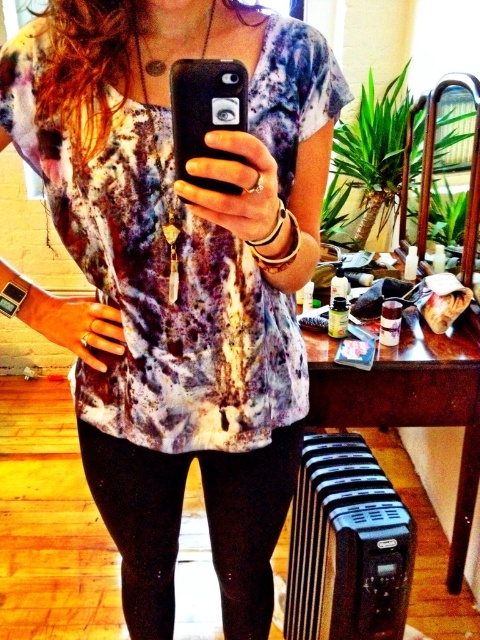
Does matte tie-dye blouse at center appear over black spandex leggings at lower center?

Yes, matte tie-dye blouse at center is above black spandex leggings at lower center.

Does matte tie-dye blouse at center have a larger size compared to black spandex leggings at lower center?

Yes.

Where is `matte tie-dye blouse at center`? The width and height of the screenshot is (480, 640). matte tie-dye blouse at center is located at coordinates (179, 275).

Can you confirm if black spandex leggings at lower center is smaller than black matte phone at center?

Incorrect, black spandex leggings at lower center is not smaller in size than black matte phone at center.

Is point (141, 620) farther from viewer compared to point (184, 161)?

Yes, point (141, 620) is farther from viewer.

Which is in front, point (119, 452) or point (196, 129)?

Point (196, 129)

The height and width of the screenshot is (640, 480). What are the coordinates of `black spandex leggings at lower center` in the screenshot? It's located at (180, 524).

Is matte tie-dye blouse at center bigger than black matte phone at center?

Yes.

Who is taller, matte tie-dye blouse at center or black matte phone at center?

Standing taller between the two is matte tie-dye blouse at center.

Is point (168, 470) behind point (204, 88)?

Yes, it is behind point (204, 88).

You are a GUI agent. You are given a task and a screenshot of the screen. Output one action in this format:
    pyautogui.click(x=<x>, y=<y>)
    Task: Click on the matte tie-dye blouse at center
    The height and width of the screenshot is (640, 480).
    Given the screenshot: What is the action you would take?
    pyautogui.click(x=179, y=275)